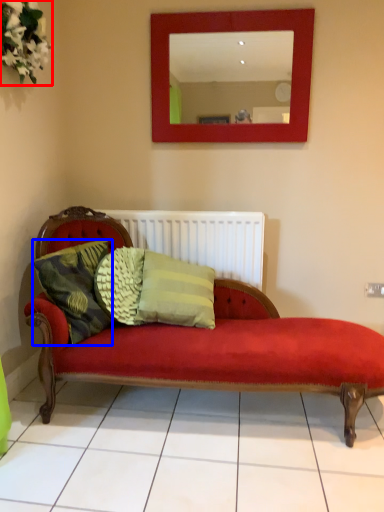
Question: Among these objects, which one is farthest to the camera, floral arrangement (highlighted by a red box) or pillow (highlighted by a blue box)?

Choices:
 (A) floral arrangement
 (B) pillow

Answer: (B)